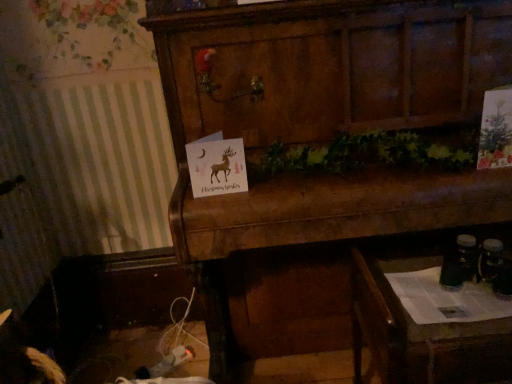
Question: Considering the positions of wooden cabinet at center and wooden drawer at lower right in the image, is wooden cabinet at center bigger or smaller than wooden drawer at lower right?

Choices:
 (A) big
 (B) small

Answer: (A)

Question: Relative to wooden drawer at lower right, is wooden cabinet at center in front or behind?

Choices:
 (A) front
 (B) behind

Answer: (A)

Question: From the image's perspective, relative to wooden drawer at lower right, is wooden cabinet at center above or below?

Choices:
 (A) below
 (B) above

Answer: (B)

Question: From their relative heights in the image, would you say wooden drawer at lower right is taller or shorter than wooden cabinet at center?

Choices:
 (A) short
 (B) tall

Answer: (A)

Question: In the image, is wooden drawer at lower right on the left side or the right side of wooden cabinet at center?

Choices:
 (A) left
 (B) right

Answer: (B)

Question: From a real-world perspective, relative to wooden cabinet at center, is wooden drawer at lower right vertically above or below?

Choices:
 (A) below
 (B) above

Answer: (A)

Question: Do you think wooden drawer at lower right is within wooden cabinet at center, or outside of it?

Choices:
 (A) outside
 (B) inside

Answer: (A)